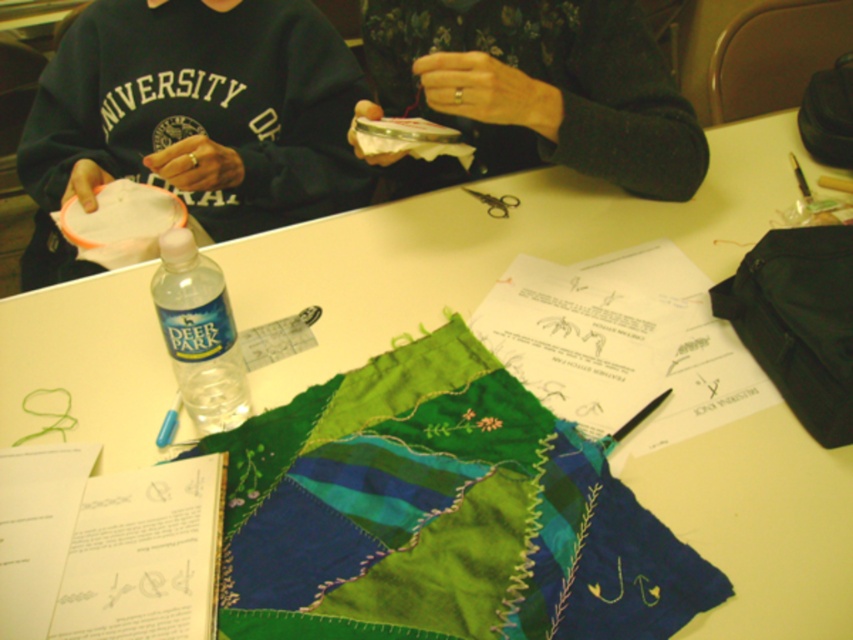
Question: Which of the following is the farthest from the observer?

Choices:
 (A) clear plastic bottle at center
 (B) matte black fabric at upper center

Answer: (B)

Question: Is textured green fabric at center above clear plastic bottle at center?

Choices:
 (A) yes
 (B) no

Answer: (B)

Question: Among these points, which one is farthest from the camera?

Choices:
 (A) (422, 1)
 (B) (693, 604)

Answer: (A)

Question: Which point appears closest to the camera in this image?

Choices:
 (A) (177, 92)
 (B) (360, 436)
 (C) (189, 304)

Answer: (C)

Question: Where is textured green fabric at center located in relation to matte black fabric at upper center in the image?

Choices:
 (A) right
 (B) left

Answer: (B)

Question: Where is textured green fabric at center located in relation to clear plastic bottle at center in the image?

Choices:
 (A) left
 (B) right

Answer: (B)